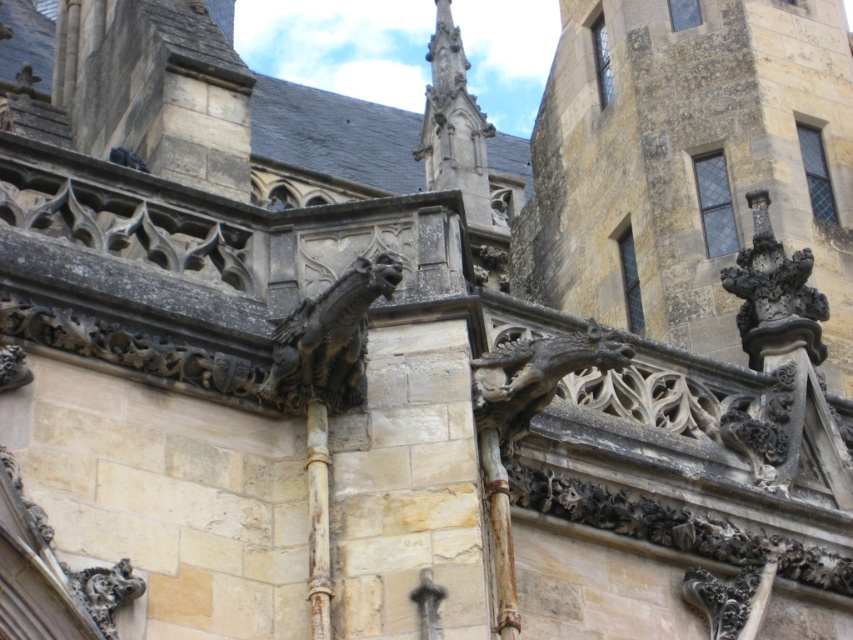
Who is lower down, dark stone gargoyle at center or carved stone gargoyle at upper right?

dark stone gargoyle at center is below.

Does dark stone gargoyle at center have a greater height compared to carved stone gargoyle at upper right?

No.

Does point (386, 276) lie in front of point (758, 214)?

Yes.

You are a GUI agent. You are given a task and a screenshot of the screen. Output one action in this format:
    pyautogui.click(x=<x>, y=<y>)
    Task: Click on the dark stone gargoyle at center
    The image size is (853, 640).
    Given the screenshot: What is the action you would take?
    pyautogui.click(x=328, y=339)